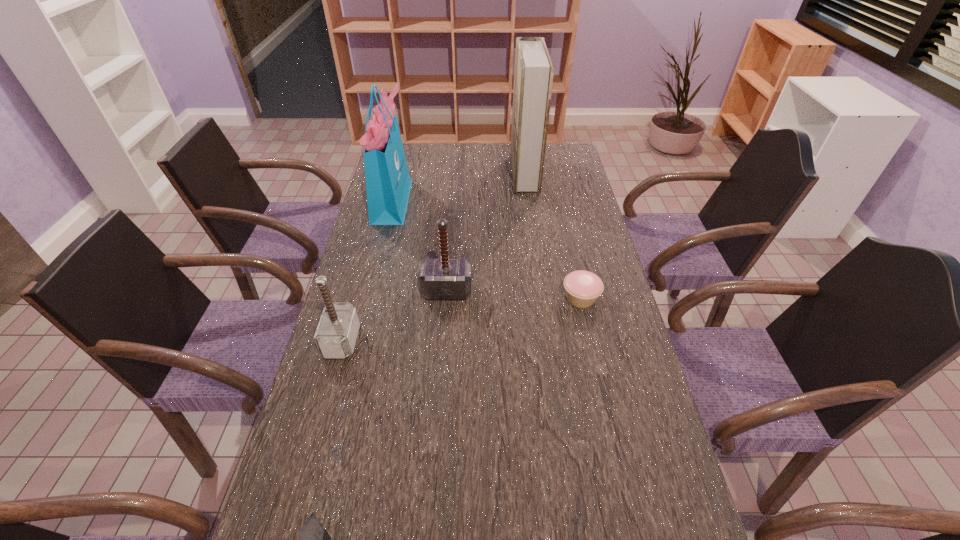
Identify which hammer is the second closest to the second farthest hammer. Please provide its 2D coordinates. Your answer should be formatted as a tuple, i.e. [(x, y)], where the tuple contains the x and y coordinates of a point satisfying the conditions above.

[(313, 539)]

Locate an element on the screen. The width and height of the screenshot is (960, 540). blank space that satisfies the following two spatial constraints: 1. on the cover of the phonebook; 2. on the back side of the second shortest object is located at coordinates (541, 298).

Find the location of `vacant region that satisfies the following two spatial constraints: 1. on the cover of the fifth object from left to right; 2. on the left side of the cupcake`. vacant region that satisfies the following two spatial constraints: 1. on the cover of the fifth object from left to right; 2. on the left side of the cupcake is located at coordinates (541, 298).

Identify the location of vacant space that satisfies the following two spatial constraints: 1. on the front side of the shopping bag; 2. on the left side of the rightmost object. (368, 298).

Locate an element on the screen. This screenshot has width=960, height=540. vacant position in the image that satisfies the following two spatial constraints: 1. on the cover of the phonebook; 2. on the back side of the rightmost object is located at coordinates (541, 298).

This screenshot has width=960, height=540. In order to click on vacant region that satisfies the following two spatial constraints: 1. on the cover of the rightmost object; 2. on the right side of the phonebook in this screenshot , I will do `click(541, 298)`.

Locate an element on the screen. free location that satisfies the following two spatial constraints: 1. on the cover of the second object from right to left; 2. on the right side of the second shortest object is located at coordinates (541, 298).